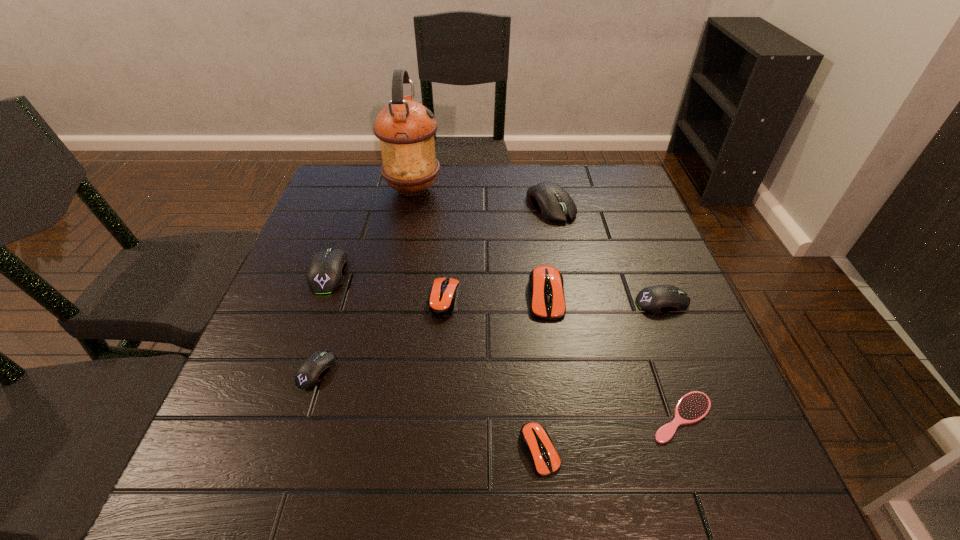
This screenshot has height=540, width=960. I want to click on the nearest black computer equipment, so click(309, 374).

The image size is (960, 540). Identify the location of the smallest orange computer mouse. (536, 441).

You are a GUI agent. You are given a task and a screenshot of the screen. Output one action in this format:
    pyautogui.click(x=<x>, y=<y>)
    Task: Click on the nearest computer mouse
    The height and width of the screenshot is (540, 960).
    Given the screenshot: What is the action you would take?
    pyautogui.click(x=536, y=441)

You are a GUI agent. You are given a task and a screenshot of the screen. Output one action in this format:
    pyautogui.click(x=<x>, y=<y>)
    Task: Click on the shortest object
    This screenshot has width=960, height=540.
    Given the screenshot: What is the action you would take?
    pyautogui.click(x=692, y=407)

The height and width of the screenshot is (540, 960). What are the coordinates of `vacant space located 0.130m on the front of the oil lamp` in the screenshot? It's located at (404, 234).

Locate an element on the screen. The image size is (960, 540). free point located on the front of the farthest black computer equipment is located at coordinates (564, 273).

Identify the location of free space located on the back of the third smallest black computer equipment. (361, 184).

I want to click on vacant space located on the left of the biggest orange computer mouse, so click(x=457, y=295).

I want to click on free location located on the left of the rightmost black computer equipment, so click(609, 302).

At what (x,y) coordinates should I click in order to perform the action: click on vacant space located on the back of the second biggest orange computer mouse. Please return your answer as a coordinate pair (x, y). The image size is (960, 540). Looking at the image, I should click on (448, 252).